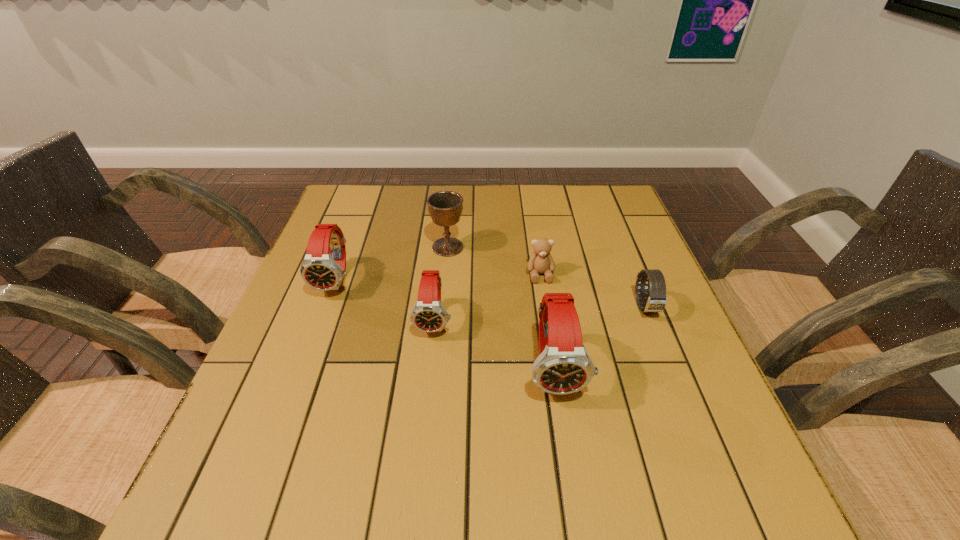
The height and width of the screenshot is (540, 960). Identify the location of the closest object relative to the leftmost watch. (428, 315).

Locate which object ranks in proximity to the leftmost object. Please provide its 2D coordinates. Your answer should be formatted as a tuple, i.e. [(x, y)], where the tuple contains the x and y coordinates of a point satisfying the conditions above.

[(428, 315)]

Choose which watch is the nearest neighbor to the fourth tallest object. Please provide its 2D coordinates. Your answer should be formatted as a tuple, i.e. [(x, y)], where the tuple contains the x and y coordinates of a point satisfying the conditions above.

[(563, 366)]

Locate which watch is the third closest to the third shortest watch. Please provide its 2D coordinates. Your answer should be formatted as a tuple, i.e. [(x, y)], where the tuple contains the x and y coordinates of a point satisfying the conditions above.

[(656, 300)]